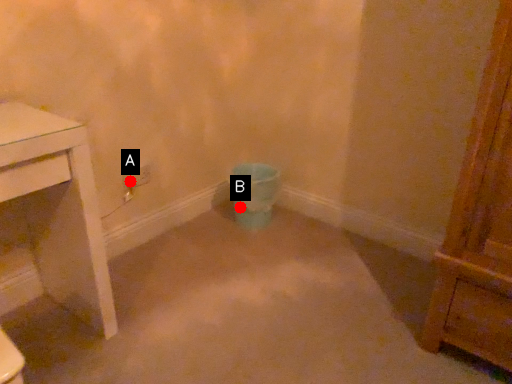
Question: Two points are circled on the image, labeled by A and B beside each circle. Which point appears farthest from the camera in this image?

Choices:
 (A) A is further
 (B) B is further

Answer: (B)